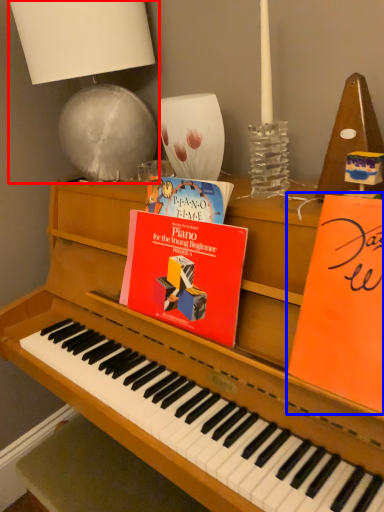
Question: Which point is closer to the camera, table lamp (highlighted by a red box) or paperback book (highlighted by a blue box)?

Choices:
 (A) table lamp
 (B) paperback book

Answer: (B)